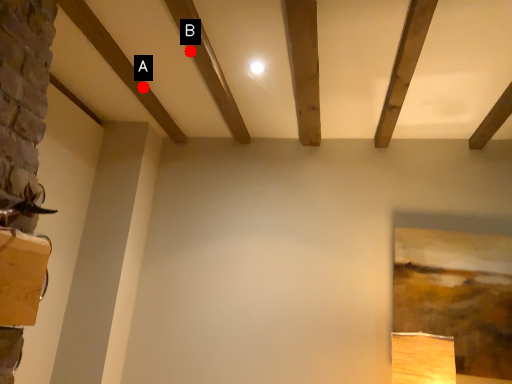
Question: Two points are circled on the image, labeled by A and B beside each circle. Which of the following is the closest to the observer?

Choices:
 (A) A is closer
 (B) B is closer

Answer: (B)